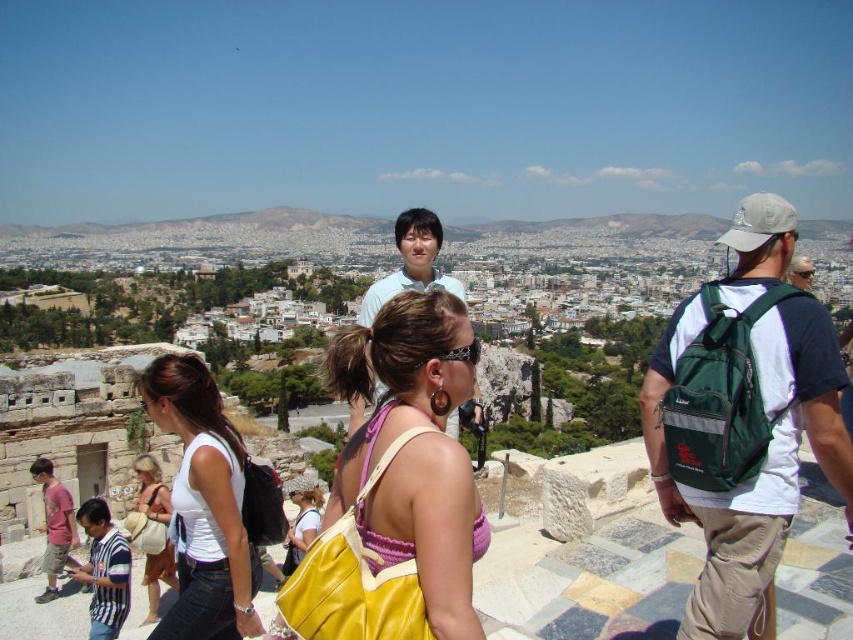
Does green fabric backpack at right have a larger size compared to beige fabric purse at center?

Yes.

Between point (691, 452) and point (149, 481), which one is positioned behind?

Point (149, 481)

You are a GUI agent. You are given a task and a screenshot of the screen. Output one action in this format:
    pyautogui.click(x=<x>, y=<y>)
    Task: Click on the green fabric backpack at right
    
    Given the screenshot: What is the action you would take?
    pyautogui.click(x=743, y=419)

Where is `green fabric backpack at right`? green fabric backpack at right is located at coordinates (743, 419).

Can you confirm if yellow fabric purse at center is thinner than beige fabric purse at center?

Incorrect, yellow fabric purse at center's width is not less than beige fabric purse at center's.

Is yellow fabric purse at center shorter than beige fabric purse at center?

Incorrect, yellow fabric purse at center's height does not fall short of beige fabric purse at center's.

You are a GUI agent. You are given a task and a screenshot of the screen. Output one action in this format:
    pyautogui.click(x=<x>, y=<y>)
    Task: Click on the yellow fabric purse at center
    Image resolution: width=853 pixels, height=640 pixels.
    Given the screenshot: What is the action you would take?
    pyautogui.click(x=415, y=451)

Describe the element at coordinates (410, 262) in the screenshot. This screenshot has width=853, height=640. I see `light blue shirt at center` at that location.

Can you confirm if light blue shirt at center is taller than beige fabric purse at center?

Indeed, light blue shirt at center has a greater height compared to beige fabric purse at center.

Is point (363, 404) less distant than point (171, 556)?

No, it is behind (171, 556).

Where is `light blue shirt at center`? light blue shirt at center is located at coordinates (410, 262).